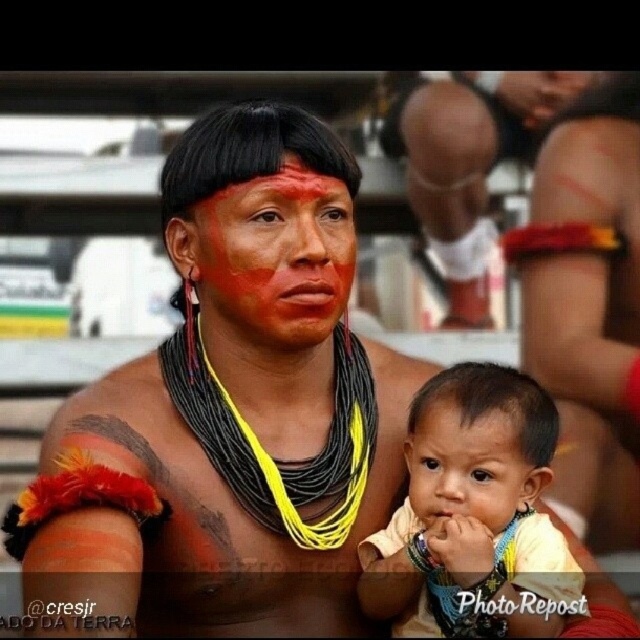
You are an artist trying to draw the scene. You notice two points in the image at coordinates point (305, 282) and point (481, 429). Which point is closer to you?

Point (305, 282) is closer to you than point (481, 429) because it is further to the viewer.

You are a photographer trying to capture a closeup shot of the smooth skin baby at center. The camera you are using has a minimum focusing distance of 10 feet. Can you take the photo without moving closer?

The smooth skin baby at center is 8.67 feet away from the camera, which is closer than the minimum focusing distance of 10 feet. Therefore, you cannot take the closeup shot without moving closer.

You are a photographer taking a closeup shot of the adult and baby. Which object, the smooth skin baby at center or the matte orange forehead at center, is positioned in front of the other?

The smooth skin baby at center is closer to the viewer than the matte orange forehead at center, so the smooth skin baby at center is positioned in front of the matte orange forehead at center.